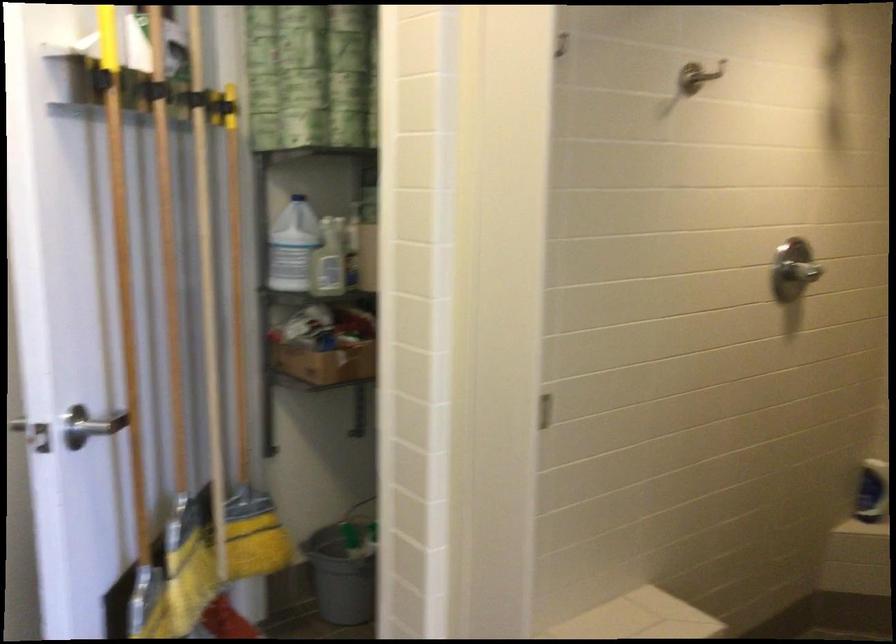
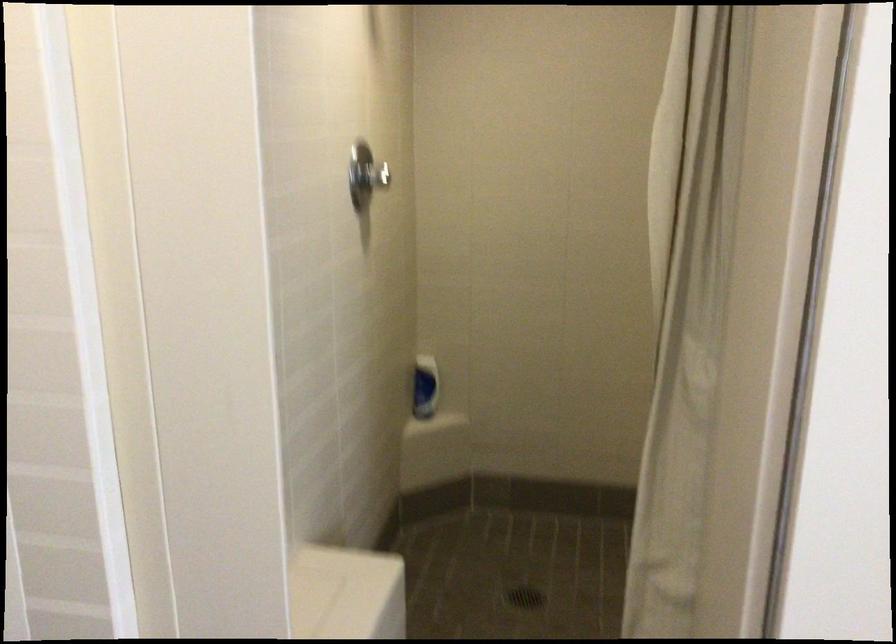
Question: Based on the continuous images, in which direction is the camera rotating? Reply with the corresponding letter.

Choices:
 (A) Left
 (B) Right
 (C) Up
 (D) Down

Answer: (B)